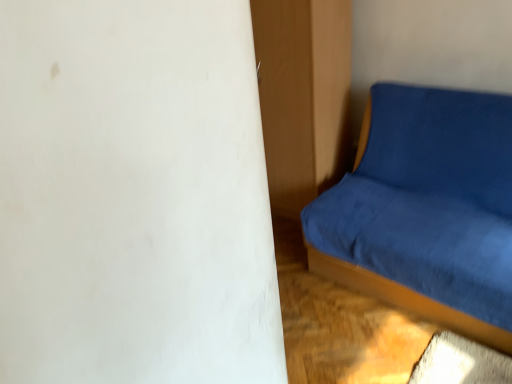
Question: Is matte wood dresser at center positioned with its back to blue fabric studio couch at right?

Choices:
 (A) yes
 (B) no

Answer: (B)

Question: Would you consider matte wood dresser at center to be distant from blue fabric studio couch at right?

Choices:
 (A) no
 (B) yes

Answer: (A)

Question: Can you confirm if matte wood dresser at center is taller than blue fabric studio couch at right?

Choices:
 (A) no
 (B) yes

Answer: (B)

Question: Is matte wood dresser at center next to blue fabric studio couch at right?

Choices:
 (A) yes
 (B) no

Answer: (B)

Question: Can you confirm if matte wood dresser at center is bigger than blue fabric studio couch at right?

Choices:
 (A) no
 (B) yes

Answer: (A)

Question: Could you tell me if matte wood dresser at center is facing blue fabric studio couch at right?

Choices:
 (A) no
 (B) yes

Answer: (A)

Question: From a real-world perspective, is blue fabric studio couch at right physically below matte wood dresser at center?

Choices:
 (A) no
 (B) yes

Answer: (B)

Question: Does blue fabric studio couch at right come in front of matte wood dresser at center?

Choices:
 (A) no
 (B) yes

Answer: (B)

Question: Is blue fabric studio couch at right to the right of matte wood dresser at center from the viewer's perspective?

Choices:
 (A) yes
 (B) no

Answer: (A)

Question: Is blue fabric studio couch at right oriented away from matte wood dresser at center?

Choices:
 (A) no
 (B) yes

Answer: (A)

Question: From a real-world perspective, is blue fabric studio couch at right located higher than matte wood dresser at center?

Choices:
 (A) yes
 (B) no

Answer: (B)

Question: Does blue fabric studio couch at right have a lesser width compared to matte wood dresser at center?

Choices:
 (A) yes
 (B) no

Answer: (B)

Question: From the image's perspective, is blue fabric studio couch at right located above or below matte wood dresser at center?

Choices:
 (A) above
 (B) below

Answer: (B)